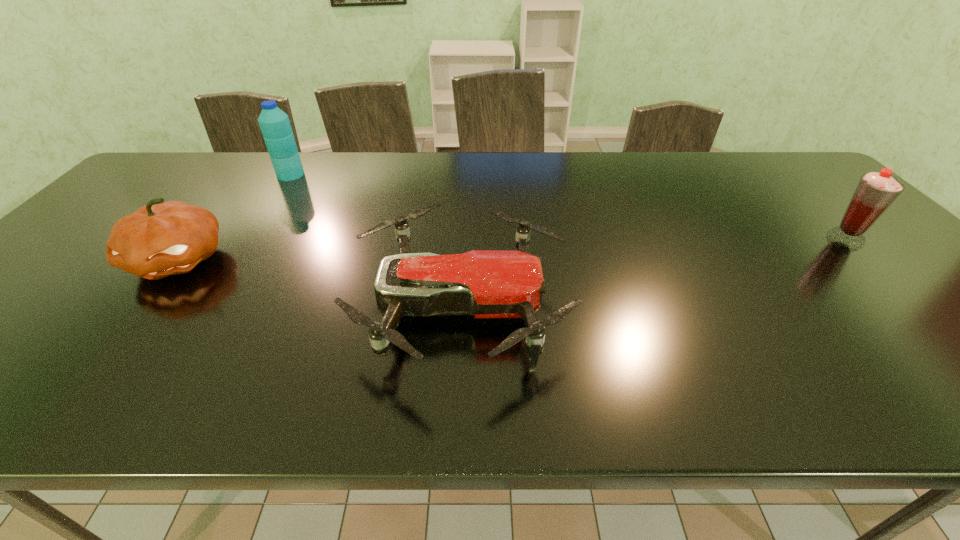
This screenshot has width=960, height=540. I want to click on the farthest object, so click(275, 126).

You are a GUI agent. You are given a task and a screenshot of the screen. Output one action in this format:
    pyautogui.click(x=<x>, y=<y>)
    Task: Click on the rightmost object
    
    Given the screenshot: What is the action you would take?
    pyautogui.click(x=875, y=192)

Image resolution: width=960 pixels, height=540 pixels. I want to click on pumpkin, so click(x=156, y=241).

Where is `the third object from left to right`? Image resolution: width=960 pixels, height=540 pixels. the third object from left to right is located at coordinates (489, 284).

Locate an element on the screen. the shortest object is located at coordinates (489, 284).

Where is `vacant point located on the left of the water bottle`? The image size is (960, 540). vacant point located on the left of the water bottle is located at coordinates click(231, 174).

Locate an element on the screen. free spot located 0.200m on the front of the rightmost object is located at coordinates (911, 303).

Locate an element on the screen. This screenshot has width=960, height=540. blank space located on the front face of the third tallest object is located at coordinates (99, 361).

The height and width of the screenshot is (540, 960). I want to click on vacant area situated on the front-facing side of the third object from left to right, so click(651, 307).

This screenshot has height=540, width=960. What are the coordinates of `object positioned at the far edge` in the screenshot? It's located at (275, 126).